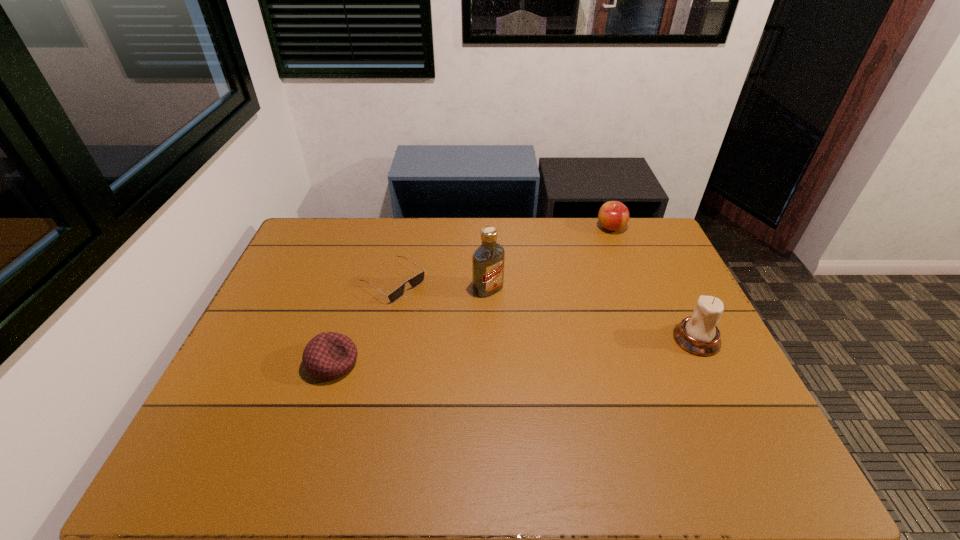
The width and height of the screenshot is (960, 540). Identify the location of blank space located 0.170m on the front-facing side of the sunglasses. (456, 323).

Find the location of a particular element. vacant space located 0.060m on the front-facing side of the sunglasses is located at coordinates click(x=429, y=306).

Where is `free location located 0.090m on the stem of the third shortest object`? The width and height of the screenshot is (960, 540). free location located 0.090m on the stem of the third shortest object is located at coordinates (600, 248).

Identify the location of vacant space situated on the stem of the third shortest object. The width and height of the screenshot is (960, 540). (574, 295).

Locate an element on the screen. This screenshot has width=960, height=540. vacant space positioned 0.260m on the stem of the third shortest object is located at coordinates (585, 276).

Identify the location of vacant area situated on the front-facing side of the tallest object. (564, 356).

Find the location of `free space located 0.080m on the front-facing side of the tallest object`. free space located 0.080m on the front-facing side of the tallest object is located at coordinates (515, 311).

Image resolution: width=960 pixels, height=540 pixels. I want to click on vacant region located on the front-facing side of the tallest object, so click(x=579, y=368).

You are a GUI agent. You are given a task and a screenshot of the screen. Output one action in this format:
    pyautogui.click(x=<x>, y=<y>)
    Task: Click on the object situated at the far edge
    This screenshot has height=540, width=960.
    Given the screenshot: What is the action you would take?
    pyautogui.click(x=613, y=215)

Find the location of a particular element. candle holder located at the right edge is located at coordinates (698, 334).